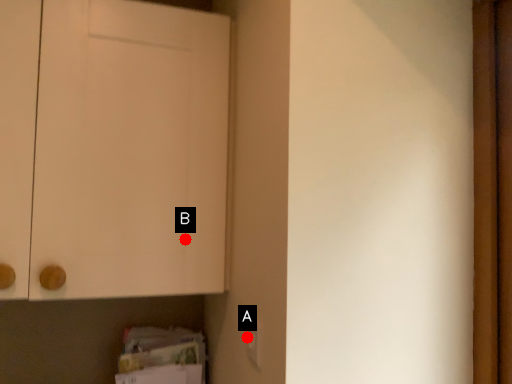
Question: Two points are circled on the image, labeled by A and B beside each circle. Which point is closer to the camera?

Choices:
 (A) A is closer
 (B) B is closer

Answer: (A)